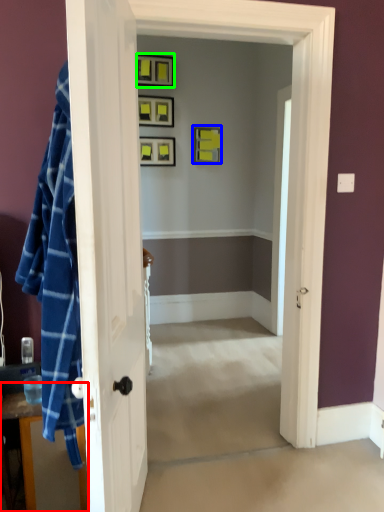
Question: Based on their relative distances, which object is nearer to dresser (highlighted by a red box)? Choose from picture frame (highlighted by a blue box) and picture frame (highlighted by a green box).

Choices:
 (A) picture frame
 (B) picture frame

Answer: (A)